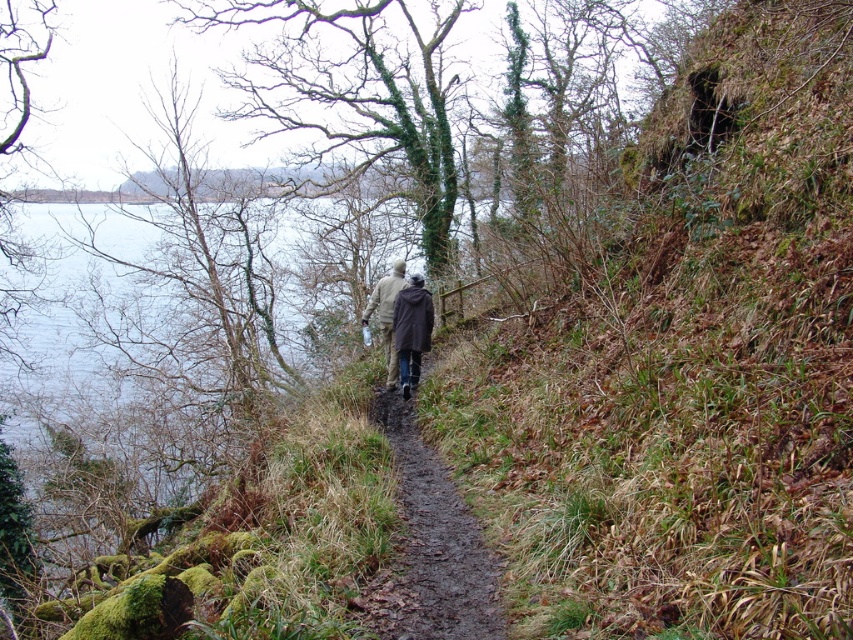
Question: Among these objects, which one is nearest to the camera?

Choices:
 (A) dark brown leather jacket at center
 (B) camouflage jacket at center
 (C) brown dirt path at center

Answer: (C)

Question: Which object appears farthest from the camera in this image?

Choices:
 (A) brown dirt path at center
 (B) camouflage jacket at center
 (C) dark brown leather jacket at center

Answer: (B)

Question: Does brown dirt path at center have a smaller size compared to dark brown leather jacket at center?

Choices:
 (A) yes
 (B) no

Answer: (A)

Question: From the image, what is the correct spatial relationship of brown dirt path at center in relation to camouflage jacket at center?

Choices:
 (A) right
 (B) left

Answer: (A)

Question: Is brown dirt path at center to the left of dark brown leather jacket at center from the viewer's perspective?

Choices:
 (A) no
 (B) yes

Answer: (A)

Question: Among these points, which one is farthest from the camera?

Choices:
 (A) click(422, 522)
 (B) click(390, 282)

Answer: (B)